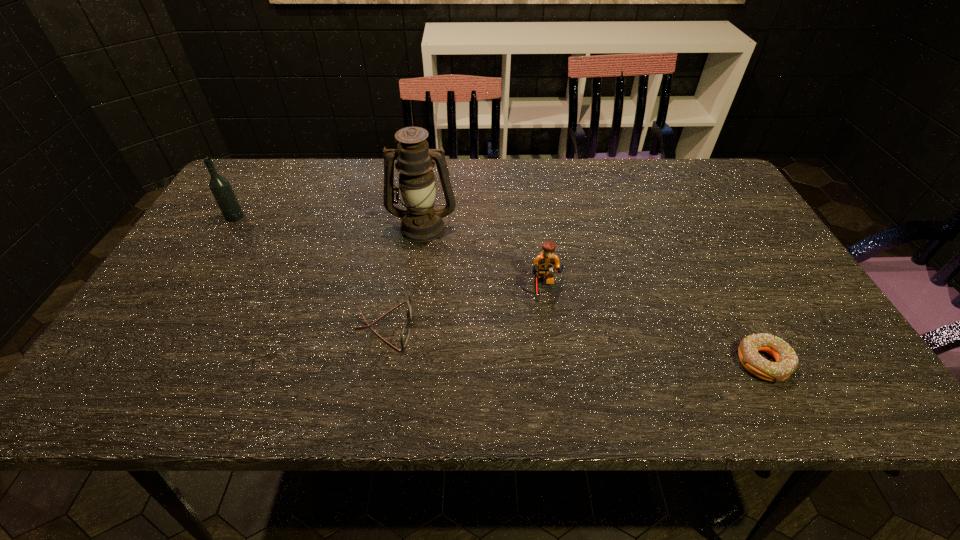
Where is `vacant region located on the front-facing side of the spectacles`? This screenshot has width=960, height=540. vacant region located on the front-facing side of the spectacles is located at coordinates (490, 326).

You are a GUI agent. You are given a task and a screenshot of the screen. Output one action in this format:
    pyautogui.click(x=<x>, y=<y>)
    Task: Click on the vacant position located 0.350m on the back of the rightmost object
    
    Given the screenshot: What is the action you would take?
    pyautogui.click(x=697, y=235)

Find the location of a particular element. object that is positioned at the near edge is located at coordinates [x=786, y=363].

Image resolution: width=960 pixels, height=540 pixels. Identify the location of object at the left edge. (220, 187).

This screenshot has width=960, height=540. I want to click on object present at the right edge, so click(786, 363).

Find the location of a particular element. This screenshot has width=960, height=540. object at the near right corner is located at coordinates (786, 363).

At what (x,y) coordinates should I click in order to perform the action: click on vacant position at the far edge of the desktop. Please return your answer as a coordinate pair (x, y). This screenshot has height=540, width=960. Looking at the image, I should click on (344, 180).

Find the location of `free space at the near edge of the desktop`. free space at the near edge of the desktop is located at coordinates (649, 382).

At what (x,y) coordinates should I click in order to perform the action: click on free space at the left edge of the desktop. Please return your answer as a coordinate pair (x, y). This screenshot has height=540, width=960. Looking at the image, I should click on (163, 333).

This screenshot has height=540, width=960. Find the location of `free point at the right edge`. free point at the right edge is located at coordinates (723, 253).